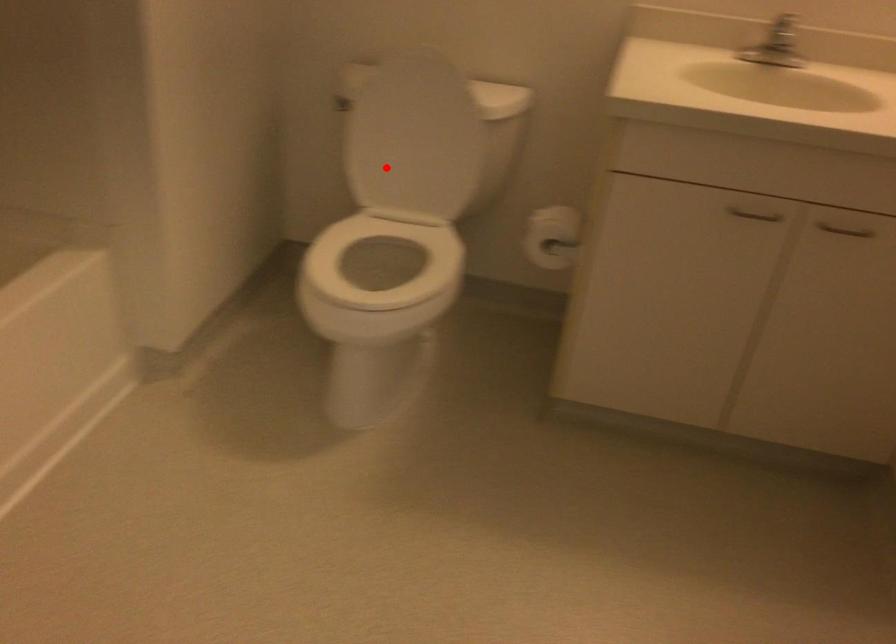
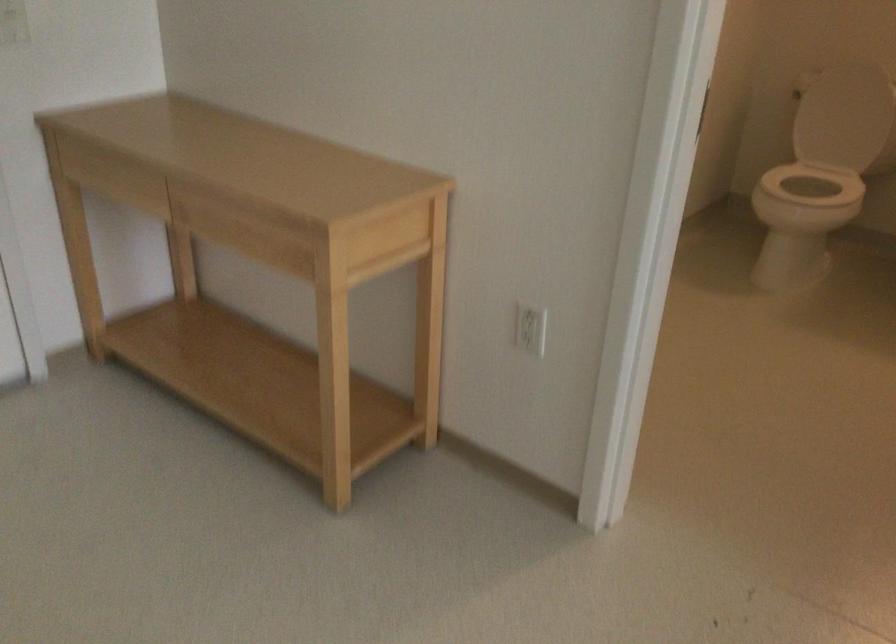
Where in the second image is the point corresponding to the highlighted location from the first image?

(839, 118)